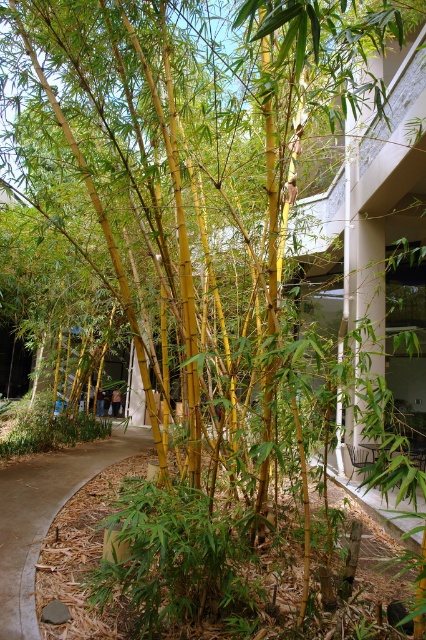
How distant is brown/dry leaves at center from brown mulch at lower left?

The distance of brown/dry leaves at center from brown mulch at lower left is 15.75 feet.

Is brown/dry leaves at center positioned in front of brown mulch at lower left?

Yes, it is.

Describe the element at coordinates (45, 515) in the screenshot. I see `brown/dry leaves at center` at that location.

The image size is (426, 640). Find the location of `brown/dry leaves at center`. brown/dry leaves at center is located at coordinates (45, 515).